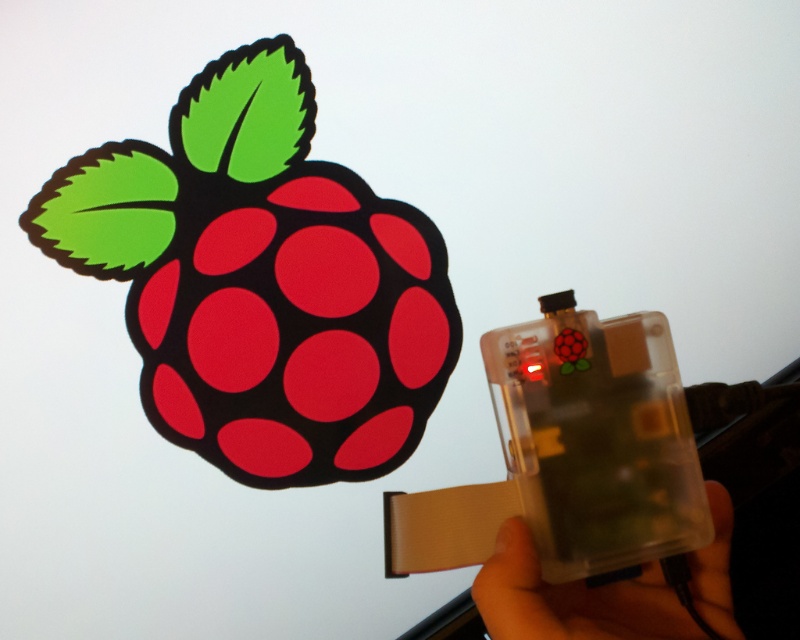
Question: Which point appears closest to the camera in this image?

Choices:
 (A) (332, 285)
 (B) (692, 621)

Answer: (B)

Question: Is matte plastic raspberry at upper left wider than clear plastic hand at lower right?

Choices:
 (A) yes
 (B) no

Answer: (A)

Question: Can you confirm if matte plastic raspberry at upper left is positioned above clear plastic hand at lower right?

Choices:
 (A) yes
 (B) no

Answer: (A)

Question: Can you confirm if matte plastic raspberry at upper left is positioned to the right of clear plastic hand at lower right?

Choices:
 (A) yes
 (B) no

Answer: (B)